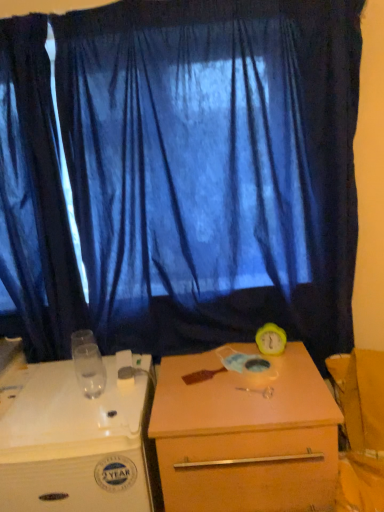
At what (x,y) coordinates should I click in order to perform the action: click on free space in front of yellow rubber alarm clock at right. Please return your answer as a coordinate pair (x, y). The image size is (384, 512). Looking at the image, I should click on point(280,378).